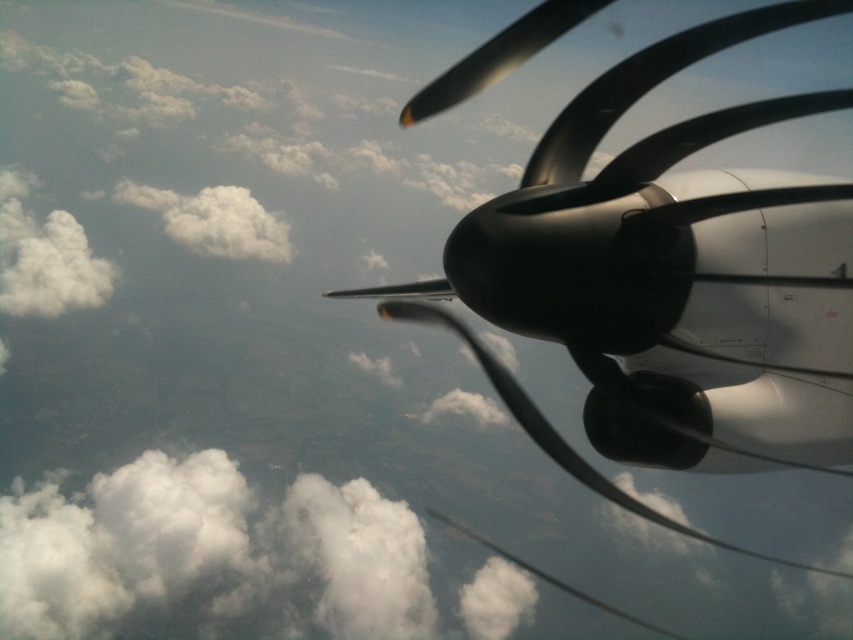
Question: Is white fluffy cloud at upper left behind white fluffy cloud at upper center?

Choices:
 (A) no
 (B) yes

Answer: (B)

Question: Which point is closer to the camera?

Choices:
 (A) polished metallic propeller at upper right
 (B) white fluffy cloud at upper left

Answer: (A)

Question: Based on their relative distances, which object is farther from the white fluffy cloud at upper left?

Choices:
 (A) white fluffy cloud at upper center
 (B) polished metallic propeller at upper right

Answer: (B)

Question: Does white fluffy cloud at upper left appear on the left side of white fluffy cloud at upper center?

Choices:
 (A) no
 (B) yes

Answer: (B)

Question: Among these objects, which one is farthest from the camera?

Choices:
 (A) white fluffy cloud at upper left
 (B) polished metallic propeller at upper right
 (C) white fluffy cloud at upper center

Answer: (A)

Question: Is polished metallic propeller at upper right thinner than white fluffy cloud at upper center?

Choices:
 (A) no
 (B) yes

Answer: (A)